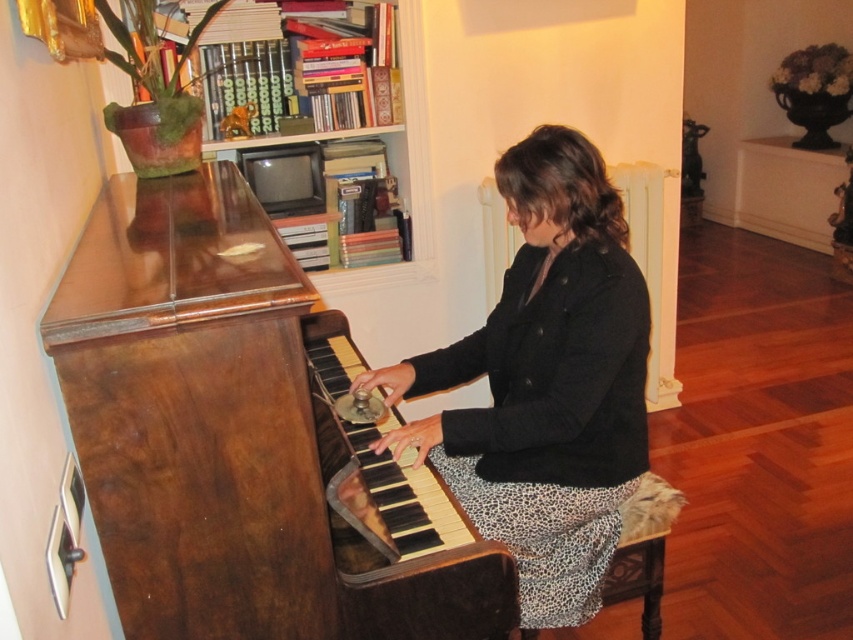
Which is above, shiny brown piano at center or wooden bookshelf at upper center?

Positioned higher is wooden bookshelf at upper center.

Between point (331, 380) and point (363, 291), which one is positioned behind?

The point (363, 291) is more distant.

This screenshot has height=640, width=853. What are the coordinates of `shiny brown piano at center` in the screenshot? It's located at (239, 436).

From the picture: Between black textured coat at center and leopard print fabric at lower center, which one is positioned lower?

leopard print fabric at lower center is lower down.

Does black textured coat at center appear on the right side of leopard print fabric at lower center?

No, black textured coat at center is not to the right of leopard print fabric at lower center.

Measure the distance between black textured coat at center and camera.

black textured coat at center is 1.46 meters away from camera.

I want to click on black textured coat at center, so click(x=544, y=384).

What do you see at coordinates (239, 436) in the screenshot? I see `shiny brown piano at center` at bounding box center [239, 436].

Which is more to the right, shiny brown piano at center or black textured coat at center?

black textured coat at center

Where is `shiny brown piano at center`? This screenshot has height=640, width=853. shiny brown piano at center is located at coordinates (239, 436).